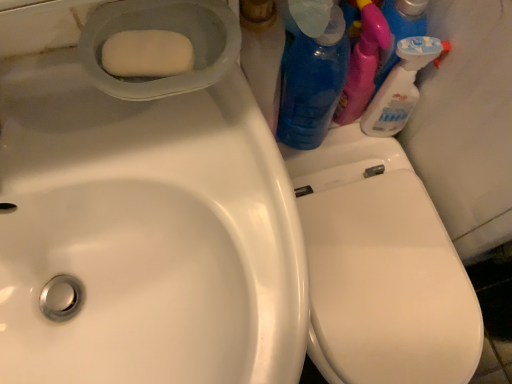
Question: Is white glossy sink at upper left shorter than white matte soap at upper left?

Choices:
 (A) yes
 (B) no

Answer: (B)

Question: From the image's perspective, is white glossy sink at upper left on top of white matte soap at upper left?

Choices:
 (A) no
 (B) yes

Answer: (A)

Question: Is white glossy sink at upper left at the right side of white matte soap at upper left?

Choices:
 (A) no
 (B) yes

Answer: (A)

Question: Is white glossy sink at upper left bigger than white matte soap at upper left?

Choices:
 (A) no
 (B) yes

Answer: (B)

Question: From a real-world perspective, is white glossy sink at upper left beneath white matte soap at upper left?

Choices:
 (A) yes
 (B) no

Answer: (A)

Question: Considering the relative sizes of white glossy sink at upper left and white matte soap at upper left in the image provided, is white glossy sink at upper left taller than white matte soap at upper left?

Choices:
 (A) yes
 (B) no

Answer: (A)

Question: From a real-world perspective, is white glossy spray bottle at upper right, acting as the second cleaning product starting from the left, beneath white matte soap at upper left?

Choices:
 (A) no
 (B) yes

Answer: (B)

Question: Is white glossy spray bottle at upper right, acting as the second cleaning product starting from the left, positioned beyond the bounds of white matte soap at upper left?

Choices:
 (A) no
 (B) yes

Answer: (B)

Question: Is white glossy spray bottle at upper right, which is counted as the 1th cleaning product, starting from the right, surrounding white matte soap at upper left?

Choices:
 (A) no
 (B) yes

Answer: (A)

Question: Could you tell me if white glossy spray bottle at upper right, acting as the second cleaning product starting from the left, is turned towards white matte soap at upper left?

Choices:
 (A) no
 (B) yes

Answer: (A)

Question: Would you consider white glossy spray bottle at upper right, acting as the second cleaning product starting from the left, to be distant from white matte soap at upper left?

Choices:
 (A) no
 (B) yes

Answer: (A)

Question: From a real-world perspective, is white glossy spray bottle at upper right, which is counted as the 1th cleaning product, starting from the right, physically above white matte soap at upper left?

Choices:
 (A) yes
 (B) no

Answer: (B)

Question: From a real-world perspective, does white matte soap at upper left sit lower than blue translucent bottle at upper right, acting as the second cleaning product starting from the right?

Choices:
 (A) no
 (B) yes

Answer: (A)